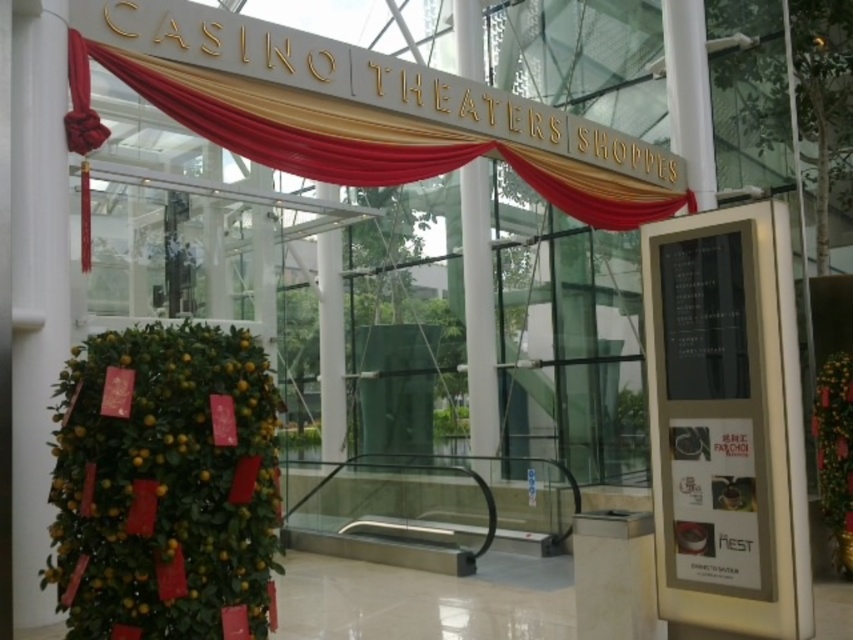
Question: Which of the following is the farthest from the observer?

Choices:
 (A) (752, 552)
 (B) (387, 177)

Answer: (B)

Question: Considering the relative positions of metallic gold sign at right and gold satin curtain at upper center in the image provided, where is metallic gold sign at right located with respect to gold satin curtain at upper center?

Choices:
 (A) below
 (B) above

Answer: (A)

Question: Which point is farther to the camera?

Choices:
 (A) coord(70,115)
 (B) coord(688,490)

Answer: (A)

Question: Is metallic gold sign at right bigger than gold satin curtain at upper center?

Choices:
 (A) no
 (B) yes

Answer: (A)

Question: Is metallic gold sign at right smaller than gold satin curtain at upper center?

Choices:
 (A) no
 (B) yes

Answer: (B)